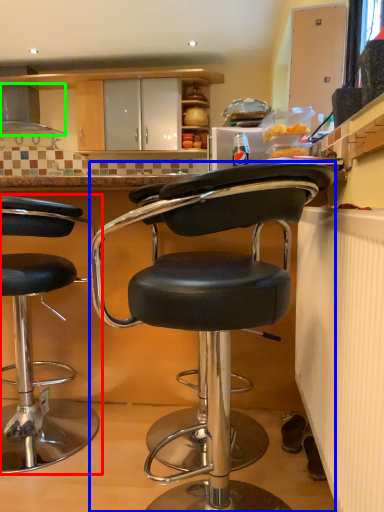
Question: Which object is positioned closest to chair (highlighted by a red box)? Select from chair (highlighted by a blue box) and exhaust hood (highlighted by a green box).

Choices:
 (A) chair
 (B) exhaust hood

Answer: (A)